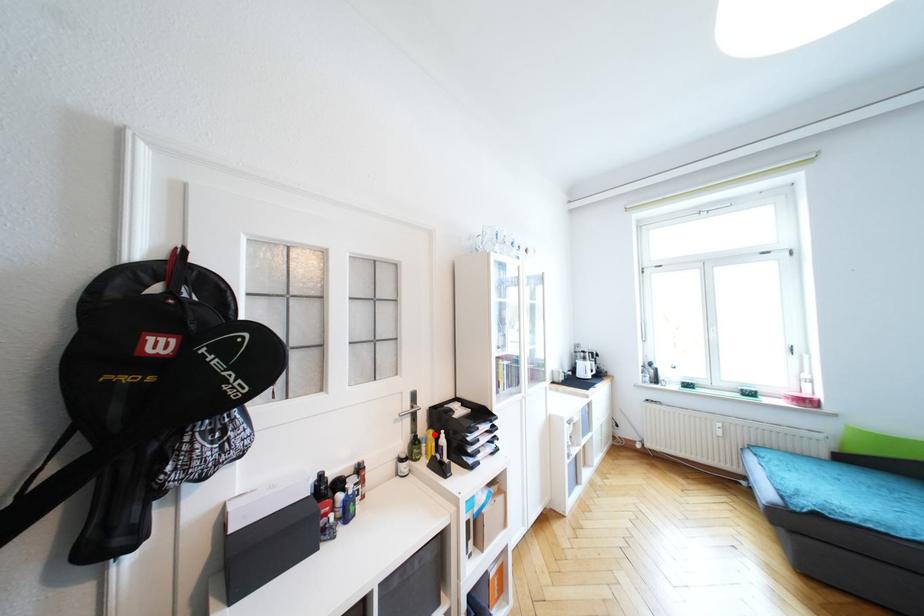
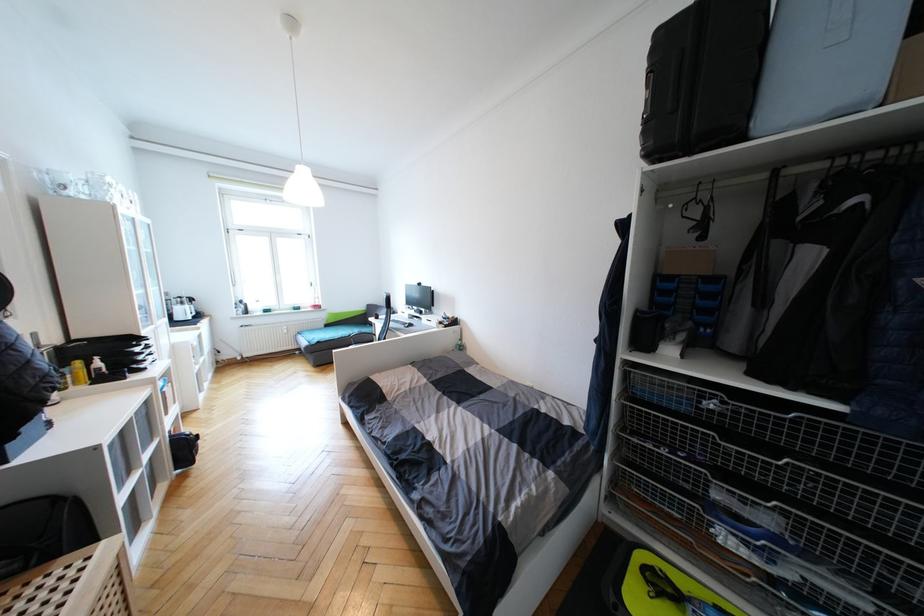
Question: I am providing you with two images of the same scene from different viewpoints. In image1, a red point is highlighted. Considering the same 3D point in image2, which of the following is correct?

Choices:
 (A) It is closer
 (B) It is farther

Answer: (B)